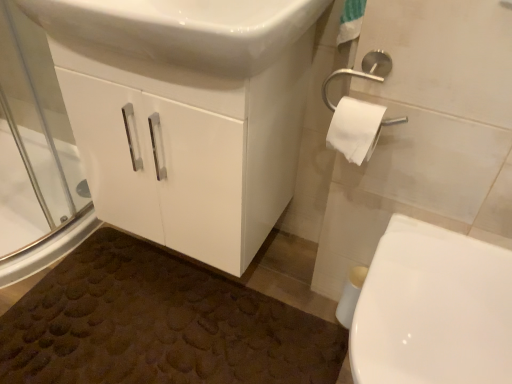
Describe the element at coordinates (433, 309) in the screenshot. The width and height of the screenshot is (512, 384). I see `white glossy toilet at lower right` at that location.

Image resolution: width=512 pixels, height=384 pixels. Describe the element at coordinates (187, 147) in the screenshot. I see `white glossy cabinet at center` at that location.

Describe the element at coordinates (181, 30) in the screenshot. The height and width of the screenshot is (384, 512). I see `white glossy sink at upper center` at that location.

Find the location of a particular element. This screenshot has width=512, height=384. white matte toilet paper at right is located at coordinates (355, 129).

The image size is (512, 384). I want to click on transparent glass screen door at left, so point(35,156).

Is point (332, 125) closer to viewer compared to point (175, 12)?

No.

Is white matte toilet paper at right to the right of white glossy sink at upper center from the viewer's perspective?

Yes, white matte toilet paper at right is to the right of white glossy sink at upper center.

In the scene shown: From a real-world perspective, is white matte toilet paper at right positioned under white glossy sink at upper center based on gravity?

Yes.

Would you say white matte toilet paper at right is outside white glossy sink at upper center?

Indeed, white matte toilet paper at right is completely outside white glossy sink at upper center.

Is transparent glass screen door at left facing towards white glossy toilet at lower right?

Yes, transparent glass screen door at left is oriented towards white glossy toilet at lower right.

Is white glossy toilet at lower right located within transparent glass screen door at left?

Definitely not — white glossy toilet at lower right is not inside transparent glass screen door at left.

From a real-world perspective, who is located lower, transparent glass screen door at left or white glossy toilet at lower right?

white glossy toilet at lower right, from a real-world perspective.

Between white glossy sink at upper center and white glossy cabinet at center, which one has larger width?

With larger width is white glossy sink at upper center.

The width and height of the screenshot is (512, 384). What are the coordinates of `bathroom cabinet located below the white glossy sink at upper center (from the image's perspective)` in the screenshot? It's located at (187, 147).

Is white glossy sink at upper center positioned with its back to white glossy cabinet at center?

No, white glossy sink at upper center is not facing the opposite direction of white glossy cabinet at center.

Which point is more forward, (91,39) or (251,72)?

The point (251,72) is more forward.

Based on the photo, is white glossy toilet at lower right facing away from transparent glass screen door at left?

No, white glossy toilet at lower right is not facing away from transparent glass screen door at left.

Considering the sizes of objects white glossy toilet at lower right and transparent glass screen door at left in the image provided, who is thinner, white glossy toilet at lower right or transparent glass screen door at left?

Thinner between the two is transparent glass screen door at left.

Is white glossy toilet at lower right at the right side of transparent glass screen door at left?

Correct, you'll find white glossy toilet at lower right to the right of transparent glass screen door at left.

From a real-world perspective, between transparent glass screen door at left and white glossy sink at upper center, who is vertically lower?

transparent glass screen door at left is physically lower.

Considering the relative sizes of transparent glass screen door at left and white glossy sink at upper center in the image provided, is transparent glass screen door at left taller than white glossy sink at upper center?

Correct, transparent glass screen door at left is much taller as white glossy sink at upper center.

Which is closer, (x=53, y=112) or (x=216, y=36)?

Point (x=53, y=112).

In the image, is transparent glass screen door at left on the left side or the right side of white glossy sink at upper center?

transparent glass screen door at left is to the left of white glossy sink at upper center.

Would you say white glossy toilet at lower right is part of white glossy sink at upper center's contents?

No, white glossy toilet at lower right is not a part of white glossy sink at upper center.

Can you confirm if white glossy sink at upper center is bigger than white glossy toilet at lower right?

No.

Does white glossy sink at upper center lie in front of white glossy toilet at lower right?

No, white glossy sink at upper center is further to the viewer.

Between white glossy sink at upper center and white glossy toilet at lower right, which one appears on the left side from the viewer's perspective?

white glossy sink at upper center is more to the left.

Based on the photo, are white glossy cabinet at center and white glossy toilet at lower right making contact?

No, white glossy cabinet at center is not with white glossy toilet at lower right.

Based on the photo, is white glossy cabinet at center aimed at white glossy toilet at lower right?

No, white glossy cabinet at center does not turn towards white glossy toilet at lower right.

At what (x,y) coordinates should I click in order to perform the action: click on bathroom cabinet that is on the left side of white glossy toilet at lower right. Please return your answer as a coordinate pair (x, y). The height and width of the screenshot is (384, 512). Looking at the image, I should click on (187, 147).

Can you tell me how much white glossy cabinet at center and white glossy toilet at lower right differ in facing direction?

The angle between the facing direction of white glossy cabinet at center and the facing direction of white glossy toilet at lower right is 0.739 degrees.

The height and width of the screenshot is (384, 512). What are the coordinates of `sink in front of the white matte toilet paper at right` in the screenshot? It's located at (181, 30).

Find the location of `toilet below the transparent glass screen door at left (from the image's perspective)`. toilet below the transparent glass screen door at left (from the image's perspective) is located at coordinates (433, 309).

Based on their spatial positions, is brown textured bath mat at lower left or transparent glass screen door at left closer to white glossy sink at upper center?

transparent glass screen door at left is closer to white glossy sink at upper center.

Considering their positions, is white glossy sink at upper center positioned further to white glossy toilet at lower right than brown textured bath mat at lower left?

white glossy sink at upper center.

Looking at the image, which one is located closer to white matte toilet paper at right, white glossy toilet at lower right or brown textured bath mat at lower left?

Based on the image, white glossy toilet at lower right appears to be nearer to white matte toilet paper at right.

Based on their spatial positions, is transparent glass screen door at left or brown textured bath mat at lower left closer to white glossy cabinet at center?

brown textured bath mat at lower left lies closer to white glossy cabinet at center than the other object.

When comparing their distances from white glossy toilet at lower right, does white matte toilet paper at right or transparent glass screen door at left seem further?

Based on the image, transparent glass screen door at left appears to be further to white glossy toilet at lower right.

Which object lies nearer to the anchor point white matte toilet paper at right, brown textured bath mat at lower left or transparent glass screen door at left?

Among the two, brown textured bath mat at lower left is located nearer to white matte toilet paper at right.

Looking at the image, which one is located further to transparent glass screen door at left, brown textured bath mat at lower left or white glossy sink at upper center?

white glossy sink at upper center is positioned further to the anchor transparent glass screen door at left.

Looking at this image, when comparing their distances from white glossy toilet at lower right, does brown textured bath mat at lower left or white matte toilet paper at right seem further?

Among the two, brown textured bath mat at lower left is located further to white glossy toilet at lower right.

Where is `toilet paper between white glossy sink at upper center and brown textured bath mat at lower left vertically`? The image size is (512, 384). toilet paper between white glossy sink at upper center and brown textured bath mat at lower left vertically is located at coordinates (355, 129).

Where is `bathroom cabinet between transparent glass screen door at left and brown textured bath mat at lower left vertically`? bathroom cabinet between transparent glass screen door at left and brown textured bath mat at lower left vertically is located at coordinates (187, 147).

This screenshot has height=384, width=512. Find the location of `toilet paper that lies between white glossy sink at upper center and white glossy toilet at lower right from top to bottom`. toilet paper that lies between white glossy sink at upper center and white glossy toilet at lower right from top to bottom is located at coordinates (355, 129).

Find the location of a particular element. The height and width of the screenshot is (384, 512). toilet paper between transparent glass screen door at left and white glossy toilet at lower right from left to right is located at coordinates (355, 129).